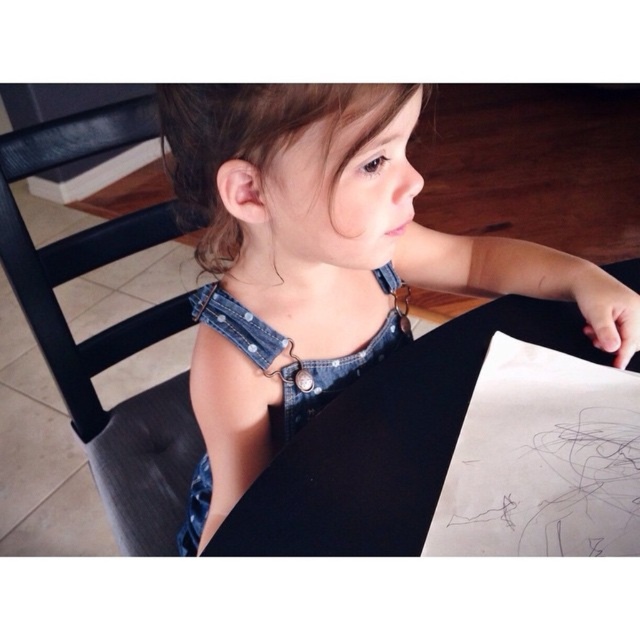
Question: Considering the relative positions of denim dress at center and black leather chair at left in the image provided, where is denim dress at center located with respect to black leather chair at left?

Choices:
 (A) right
 (B) left

Answer: (A)

Question: Which point is farther to the camera?

Choices:
 (A) black leather chair at left
 (B) denim dress at center

Answer: (A)

Question: Is denim dress at center closer to the viewer compared to black leather chair at left?

Choices:
 (A) yes
 (B) no

Answer: (A)

Question: Which point is farther from the camera taking this photo?

Choices:
 (A) (467, 243)
 (B) (100, 224)

Answer: (B)

Question: Is denim dress at center above black leather chair at left?

Choices:
 (A) no
 (B) yes

Answer: (B)

Question: Which point is farther to the camera?

Choices:
 (A) black leather chair at left
 (B) denim dress at center

Answer: (A)